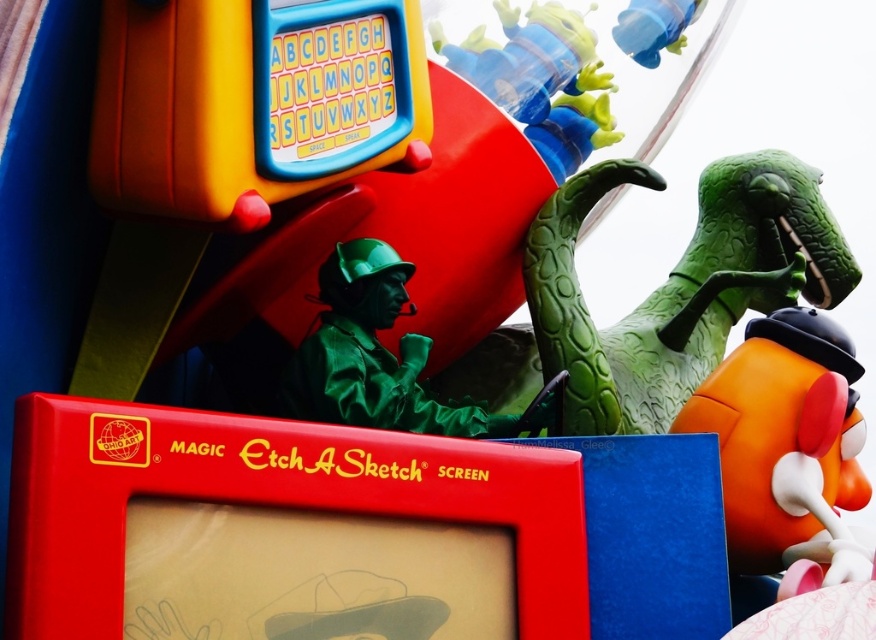
Consider the image. Does orange matte mr potato head at right have a greater width compared to blue rubber duck at upper center?

Correct, the width of orange matte mr potato head at right exceeds that of blue rubber duck at upper center.

Which is more to the right, orange matte mr potato head at right or blue rubber duck at upper center?

From the viewer's perspective, orange matte mr potato head at right appears more on the right side.

Which is in front, point (803, 380) or point (647, 26)?

Point (803, 380) is in front.

Identify the location of orange matte mr potato head at right. (788, 449).

Between point (567, 180) and point (359, 285), which one is positioned in front?

Point (359, 285) is more forward.

Who is higher up, green rubber dinosaur at upper center or green matte figure at center?

green rubber dinosaur at upper center is above.

Is point (751, 198) closer to camera compared to point (344, 410)?

No, (751, 198) is further to viewer.

Where is `green rubber dinosaur at upper center`? This screenshot has width=876, height=640. green rubber dinosaur at upper center is located at coordinates (677, 285).

Does point (765, 518) come farther from viewer compared to point (492, 426)?

That is True.

Is orange matte mr potato head at right smaller than green matte figure at center?

Incorrect, orange matte mr potato head at right is not smaller in size than green matte figure at center.

At what (x,y) coordinates should I click in order to perform the action: click on orange matte mr potato head at right. Please return your answer as a coordinate pair (x, y). Looking at the image, I should click on click(x=788, y=449).